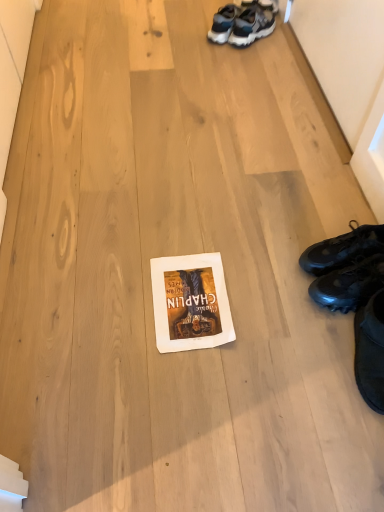
Describe the element at coordinates (190, 303) in the screenshot. I see `white paper at center` at that location.

Describe the element at coordinates (343, 249) in the screenshot. The height and width of the screenshot is (512, 384). I see `black leather shoes at right, which is counted as the first footwear, starting from the top` at that location.

You are a GUI agent. You are given a task and a screenshot of the screen. Output one action in this format:
    pyautogui.click(x=<x>, y=<y>)
    Task: Click on the white paper at center
    
    Given the screenshot: What is the action you would take?
    pyautogui.click(x=190, y=303)

What are the coordinates of `the 1st footwear above the white paper at center (from a real-world perspective)` in the screenshot? It's located at (343, 249).

Is white paper at center outside of black leather shoes at right, the second footwear when ordered from bottom to top?

Yes, white paper at center is outside of black leather shoes at right, the second footwear when ordered from bottom to top.

Which object is wider, white paper at center or black leather shoes at right, the second footwear when ordered from bottom to top?

With larger width is white paper at center.

Is white paper at center outside of black matte sneakers at lower right, arranged as the 2th footwear when viewed from the top?

Absolutely, white paper at center is external to black matte sneakers at lower right, arranged as the 2th footwear when viewed from the top.

Is black matte sneakers at lower right, arranged as the 2th footwear when viewed from the top, at the back of white paper at center?

No, white paper at center is not facing the opposite direction of black matte sneakers at lower right, arranged as the 2th footwear when viewed from the top.

Is white paper at center wider or thinner than black matte sneakers at lower right, acting as the first footwear starting from the bottom?

In the image, white paper at center appears to be wider than black matte sneakers at lower right, acting as the first footwear starting from the bottom.

From the image's perspective, is white paper at center on top of black matte sneakers at lower right, arranged as the 2th footwear when viewed from the top?

Actually, white paper at center appears below black matte sneakers at lower right, arranged as the 2th footwear when viewed from the top, in the image.

Is black matte sneakers at lower right, acting as the first footwear starting from the bottom, wider than white paper at center?

In fact, black matte sneakers at lower right, acting as the first footwear starting from the bottom, might be narrower than white paper at center.

From a real-world perspective, is black matte sneakers at lower right, acting as the first footwear starting from the bottom, over white paper at center?

Yes, from a real-world perspective, black matte sneakers at lower right, acting as the first footwear starting from the bottom, is above white paper at center.

Find the location of `paperback book located on the left of black matte sneakers at lower right, arranged as the 2th footwear when viewed from the top`. paperback book located on the left of black matte sneakers at lower right, arranged as the 2th footwear when viewed from the top is located at coordinates pyautogui.click(x=190, y=303).

How different are the orientations of black matte sneakers at lower right, arranged as the 2th footwear when viewed from the top, and black leather shoes at right, which is counted as the first footwear, starting from the top, in degrees?

They differ by 1.1e-05 degrees in their facing directions.

Considering the positions of point (360, 305) and point (382, 249), is point (360, 305) closer or farther from the camera than point (382, 249)?

Point (360, 305) is closer to the camera than point (382, 249).

Consider the image. In terms of size, does black matte sneakers at lower right, acting as the first footwear starting from the bottom, appear bigger or smaller than black leather shoes at right, which is counted as the first footwear, starting from the top?

Clearly, black matte sneakers at lower right, acting as the first footwear starting from the bottom, is smaller in size than black leather shoes at right, which is counted as the first footwear, starting from the top.

In terms of height, does black matte sneakers at lower right, arranged as the 2th footwear when viewed from the top, look taller or shorter compared to black leather shoes at right, the second footwear when ordered from bottom to top?

black matte sneakers at lower right, arranged as the 2th footwear when viewed from the top, is shorter than black leather shoes at right, the second footwear when ordered from bottom to top.

Which object is further away from the camera, black leather shoes at right, which is counted as the first footwear, starting from the top, or black matte sneakers at lower right, arranged as the 2th footwear when viewed from the top?

black leather shoes at right, which is counted as the first footwear, starting from the top.

Image resolution: width=384 pixels, height=512 pixels. Identify the location of footwear on the right of black leather shoes at right, the second footwear when ordered from bottom to top. (349, 285).

From the picture: Is black leather shoes at right, which is counted as the first footwear, starting from the top, located outside black matte sneakers at lower right, arranged as the 2th footwear when viewed from the top?

black leather shoes at right, which is counted as the first footwear, starting from the top, lies outside black matte sneakers at lower right, arranged as the 2th footwear when viewed from the top,'s area.

From the image's perspective, is black leather shoes at right, which is counted as the first footwear, starting from the top, located beneath black matte sneakers at lower right, acting as the first footwear starting from the bottom?

Actually, black leather shoes at right, which is counted as the first footwear, starting from the top, appears above black matte sneakers at lower right, acting as the first footwear starting from the bottom, in the image.

From the picture: Is black leather shoes at right, the second footwear when ordered from bottom to top, touching white paper at center?

No, black leather shoes at right, the second footwear when ordered from bottom to top, is not with white paper at center.

From a real-world perspective, is black leather shoes at right, which is counted as the first footwear, starting from the top, positioned above or below white paper at center?

In terms of real-world spatial position, black leather shoes at right, which is counted as the first footwear, starting from the top, is above white paper at center.

Is black leather shoes at right, the second footwear when ordered from bottom to top, aimed at white paper at center?

Yes, black leather shoes at right, the second footwear when ordered from bottom to top, is aimed at white paper at center.

You are a GUI agent. You are given a task and a screenshot of the screen. Output one action in this format:
    pyautogui.click(x=<x>, y=<y>)
    Task: Click on the paperback book that is in front of the black leather shoes at right, which is counted as the first footwear, starting from the top
    The width and height of the screenshot is (384, 512).
    Given the screenshot: What is the action you would take?
    pyautogui.click(x=190, y=303)

Identify the location of paperback book below the black matte sneakers at lower right, arranged as the 2th footwear when viewed from the top (from the image's perspective). (190, 303).

Looking at the image, which one is located closer to black matte sneakers at lower right, acting as the first footwear starting from the bottom, white paper at center or black leather shoes at right, which is counted as the first footwear, starting from the top?

Among the two, black leather shoes at right, which is counted as the first footwear, starting from the top, is located nearer to black matte sneakers at lower right, acting as the first footwear starting from the bottom.

Estimate the real-world distances between objects in this image. Which object is further from white paper at center, black leather shoes at right, the second footwear when ordered from bottom to top, or black matte sneakers at lower right, arranged as the 2th footwear when viewed from the top?

Among the two, black leather shoes at right, the second footwear when ordered from bottom to top, is located further to white paper at center.

Estimate the real-world distances between objects in this image. Which object is further from white paper at center, black matte sneakers at lower right, arranged as the 2th footwear when viewed from the top, or black leather shoes at right, which is counted as the first footwear, starting from the top?

Among the two, black leather shoes at right, which is counted as the first footwear, starting from the top, is located further to white paper at center.

Based on their spatial positions, is black leather shoes at right, the second footwear when ordered from bottom to top, or white paper at center further from black matte sneakers at lower right, acting as the first footwear starting from the bottom?

white paper at center is further to black matte sneakers at lower right, acting as the first footwear starting from the bottom.

Based on their spatial positions, is white paper at center or black matte sneakers at lower right, arranged as the 2th footwear when viewed from the top, closer to black leather shoes at right, the second footwear when ordered from bottom to top?

black matte sneakers at lower right, arranged as the 2th footwear when viewed from the top.

When comparing their distances from black leather shoes at right, the second footwear when ordered from bottom to top, does black matte sneakers at lower right, arranged as the 2th footwear when viewed from the top, or white paper at center seem further?

white paper at center is positioned further to the anchor black leather shoes at right, the second footwear when ordered from bottom to top.

This screenshot has height=512, width=384. What are the coordinates of `footwear between white paper at center and black matte sneakers at lower right, arranged as the 2th footwear when viewed from the top` in the screenshot? It's located at (343, 249).